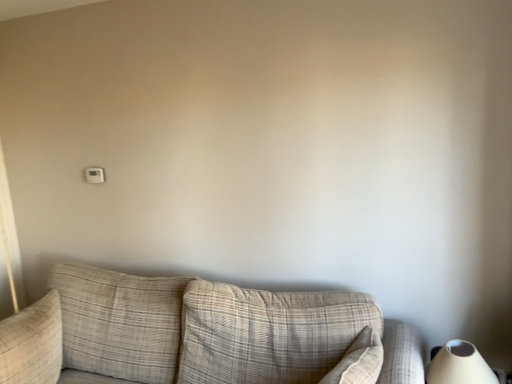
Question: In the image, is beige plaid couch at center on the left side or the right side of white matte table lamp at lower right?

Choices:
 (A) right
 (B) left

Answer: (B)

Question: Does point (78, 347) appear closer or farther from the camera than point (432, 372)?

Choices:
 (A) closer
 (B) farther

Answer: (B)

Question: Which of these objects is positioned farthest from the white matte table lamp at lower right?

Choices:
 (A) beige textured pillow at left
 (B) white plastic thermostat at upper left
 (C) beige plaid couch at center

Answer: (B)

Question: Which of these objects is positioned closest to the beige textured pillow at left?

Choices:
 (A) white matte table lamp at lower right
 (B) beige plaid couch at center
 (C) white plastic thermostat at upper left

Answer: (B)